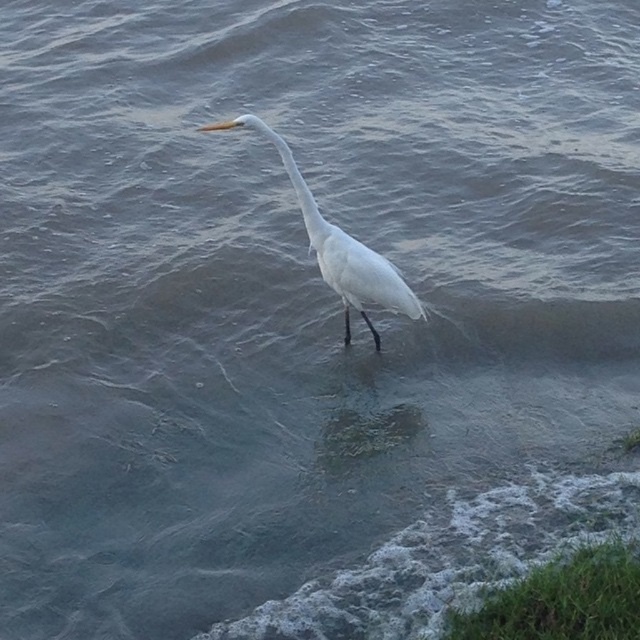
Between white matte bird at center and white smooth neck at center, which one has more height?

With more height is white matte bird at center.

Locate an element on the screen. The image size is (640, 640). white matte bird at center is located at coordinates (339, 248).

Does point (278, 145) come behind point (310, 216)?

No, (278, 145) is closer to viewer.

Identify the location of white matte bird at center. This screenshot has height=640, width=640. (339, 248).